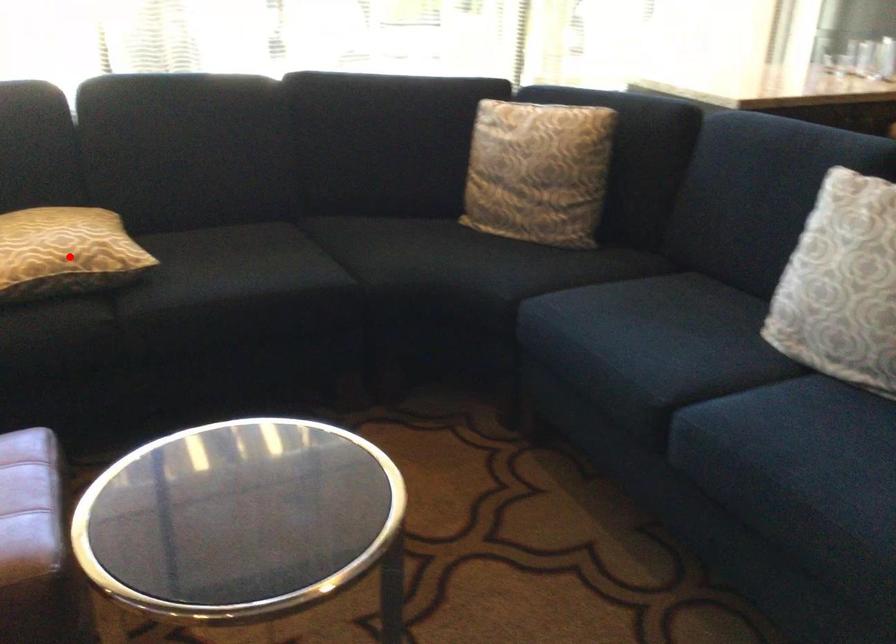
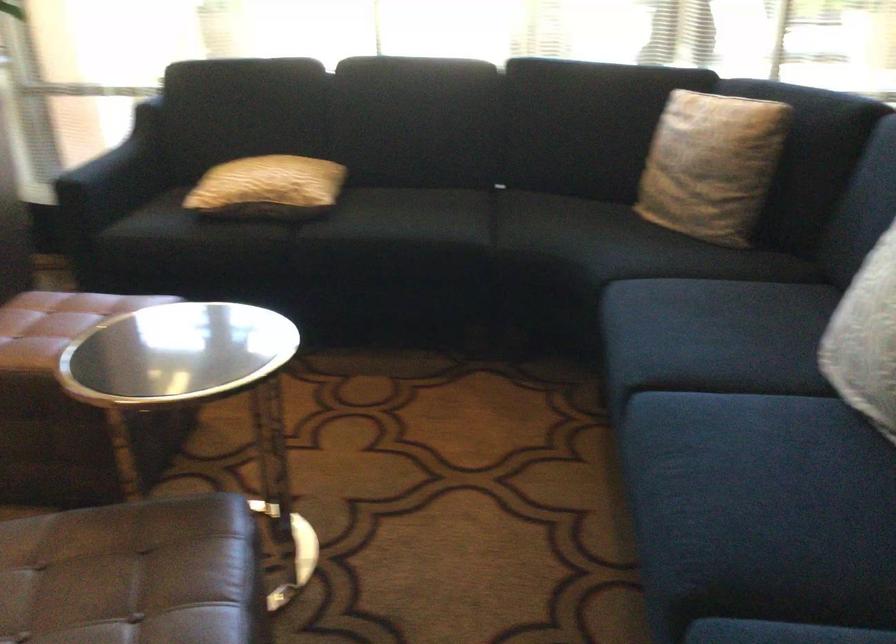
Question: A red point is marked in image1. In image2, is the corresponding 3D point closer to the camera or farther? Reply with the corresponding letter.

Choices:
 (A) The corresponding 3D point is closer.
 (B) The corresponding 3D point is farther.

Answer: (B)